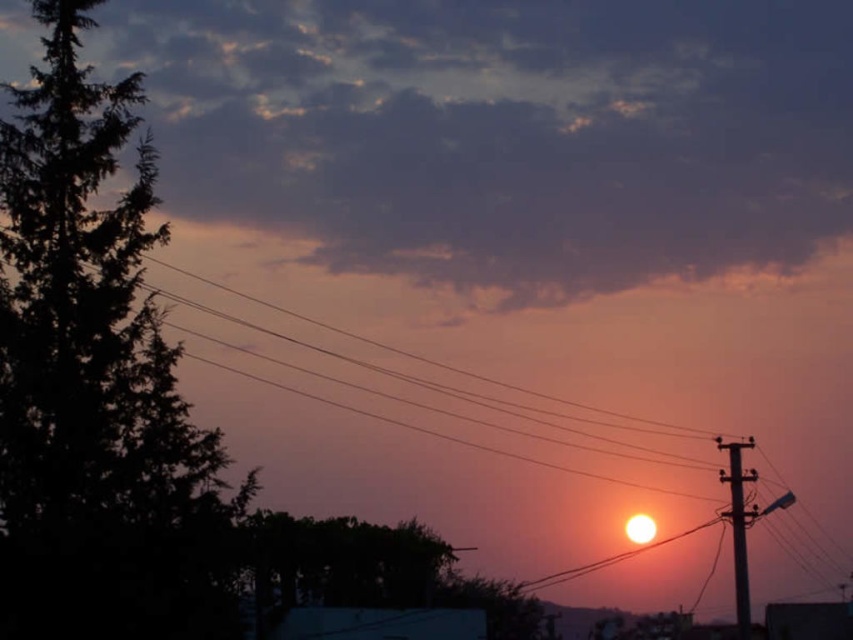
From the picture: Is the position of dark green leafy tree at left less distant than that of metallic gray telegraph pole at right?

That is True.

Who is positioned more to the left, dark green leafy tree at left or metallic gray telegraph pole at right?

dark green leafy tree at left is more to the left.

Who is more distant from viewer, (177, 637) or (741, 483)?

The point (741, 483) is behind.

The height and width of the screenshot is (640, 853). Identify the location of dark green leafy tree at left. (97, 381).

Which is behind, point (401, 317) or point (741, 609)?

The point (401, 317) is behind.

Is metallic wires at right to the right of metallic gray telegraph pole at right from the viewer's perspective?

Incorrect, metallic wires at right is not on the right side of metallic gray telegraph pole at right.

This screenshot has height=640, width=853. Identify the location of metallic wires at right. (544, 404).

Is metallic wires at right wider than dark green leafy tree at left?

Indeed, metallic wires at right has a greater width compared to dark green leafy tree at left.

Where is `metallic wires at right`? This screenshot has width=853, height=640. metallic wires at right is located at coordinates (544, 404).

Is point (404, 333) in front of point (164, 428)?

No, (404, 333) is behind (164, 428).

Find the location of a particular element. The height and width of the screenshot is (640, 853). metallic wires at right is located at coordinates (544, 404).